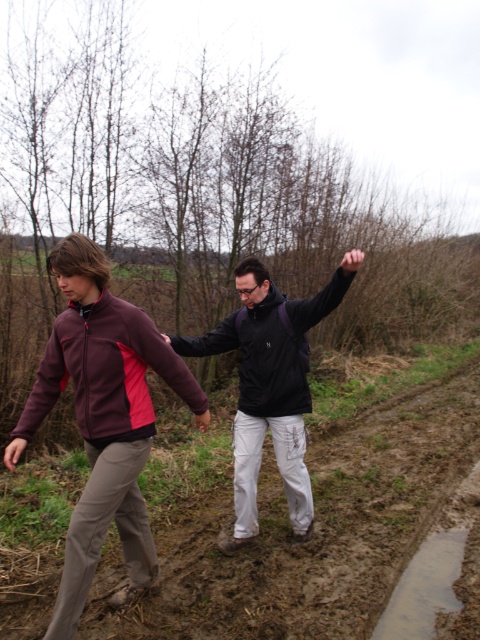
You are planning to walk along the muddy path shown in the image. You have a pair of boots that can cover a 30 cm wide area. The muddy ground at lower center and maroon fleece jacket at left are in your path. Which object will your boots definitely cover entirely?

The muddy ground at lower center is smaller than the maroon fleece jacket at left. Since your boots cover a 30 cm wide area, the muddy ground at lower center, being smaller, will be entirely covered by the boots. The maroon fleece jacket at left is larger and may not be fully covered.